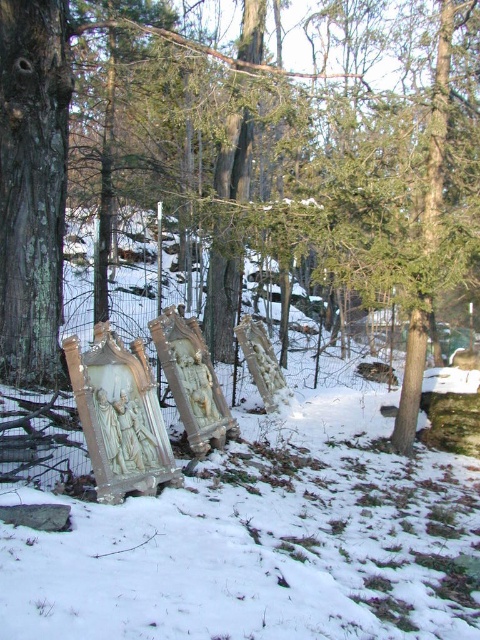
Can you confirm if brown rough tree trunk at left is positioned above white matte snow at center?

Yes, brown rough tree trunk at left is above white matte snow at center.

Who is positioned more to the right, brown rough tree trunk at left or white matte snow at center?

From the viewer's perspective, brown rough tree trunk at left appears more on the right side.

What do you see at coordinates (250, 163) in the screenshot?
I see `brown rough tree trunk at left` at bounding box center [250, 163].

Identify the location of brown rough tree trunk at left. [250, 163].